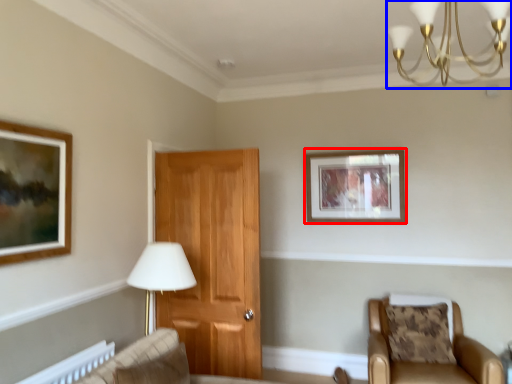
Question: Which object appears closest to the camera in this image, picture frame (highlighted by a red box) or light fixture (highlighted by a blue box)?

Choices:
 (A) picture frame
 (B) light fixture

Answer: (B)